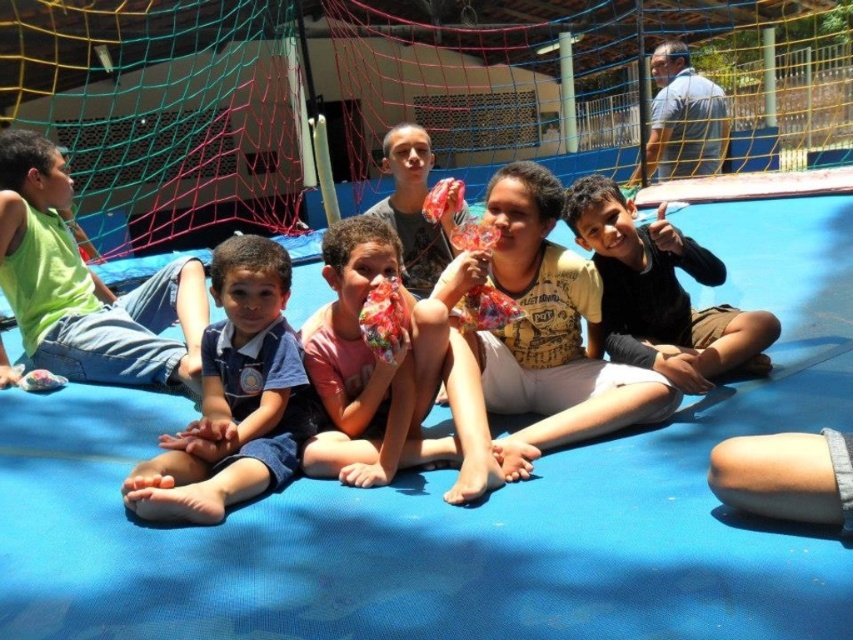
Question: Among these points, which one is farthest from the camera?

Choices:
 (A) (590, 330)
 (B) (416, 141)

Answer: (B)

Question: Based on their relative distances, which object is nearer to the blue rubber mat at center?

Choices:
 (A) green matte shirt at left
 (B) yellow printed shirt at center

Answer: (B)

Question: Is yellow mesh net at upper center below matte plastic bag at center?

Choices:
 (A) no
 (B) yes

Answer: (A)

Question: Is green matte shirt at left above matte plastic bag at center?

Choices:
 (A) no
 (B) yes

Answer: (A)

Question: Does yellow mesh net at upper center have a larger size compared to green matte shirt at left?

Choices:
 (A) no
 (B) yes

Answer: (B)

Question: Which is nearer to the blue denim shorts at left?

Choices:
 (A) matte plastic bag at center
 (B) blue rubber mat at center

Answer: (B)